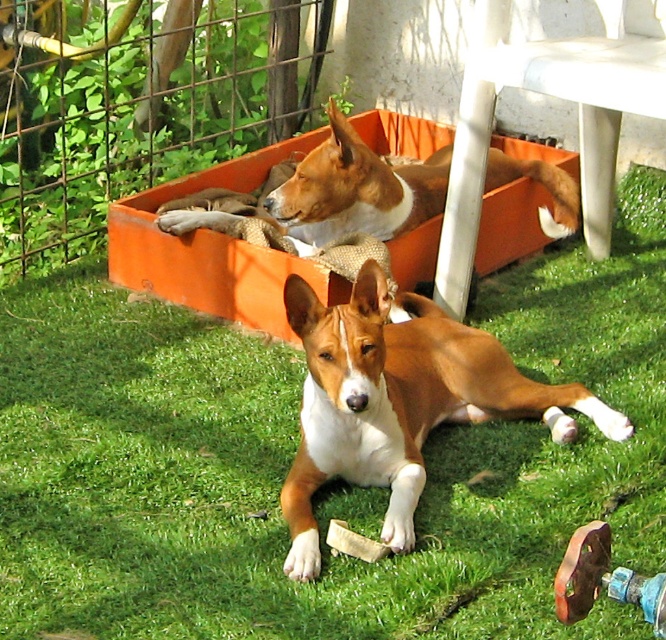
Question: Among these objects, which one is farthest from the camera?

Choices:
 (A) green grass at center
 (B) brown/white fur dog at center

Answer: (B)

Question: Among these objects, which one is farthest from the camera?

Choices:
 (A) brown/white fur dog at center
 (B) brown/white fur dog at upper center

Answer: (B)

Question: Is the position of green grass at center more distant than that of orange plastic crate at upper center?

Choices:
 (A) no
 (B) yes

Answer: (A)

Question: Which point is closer to the camera?

Choices:
 (A) (238, 252)
 (B) (304, 467)
 (C) (324, 186)

Answer: (B)

Question: Does green grass at center have a greater width compared to orange plastic crate at upper center?

Choices:
 (A) no
 (B) yes

Answer: (B)

Question: Does green grass at center appear over brown/white fur dog at center?

Choices:
 (A) yes
 (B) no

Answer: (A)